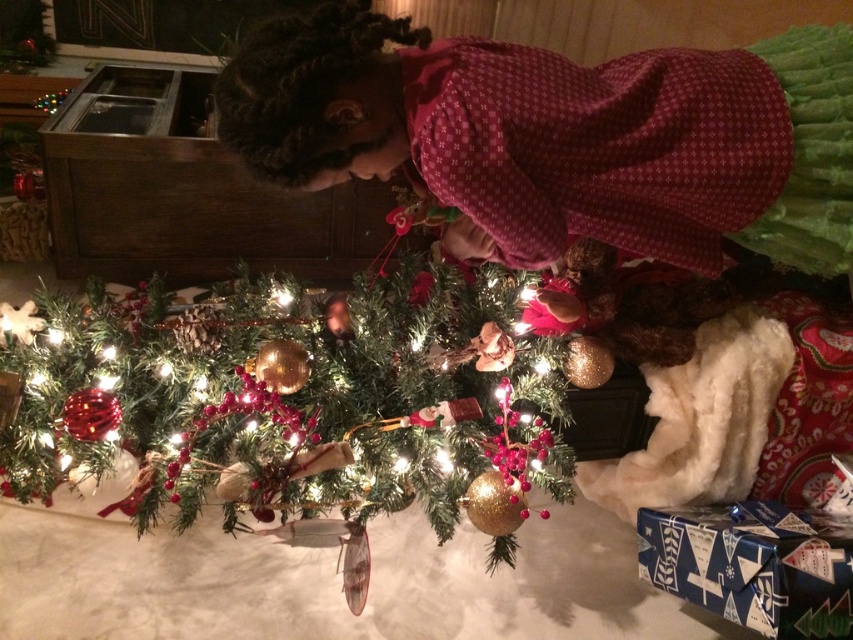
Question: Considering the relative positions of matte red dress at center and green textured christmas tree at center in the image provided, where is matte red dress at center located with respect to green textured christmas tree at center?

Choices:
 (A) left
 (B) right

Answer: (B)

Question: Is matte red dress at center positioned in front of green textured christmas tree at center?

Choices:
 (A) no
 (B) yes

Answer: (B)

Question: Does matte red dress at center appear on the right side of green textured christmas tree at center?

Choices:
 (A) no
 (B) yes

Answer: (B)